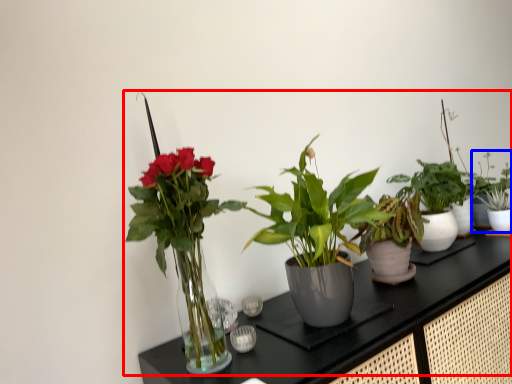
Question: Which object appears closest to the camera in this image, houseplant (highlighted by a red box) or houseplant (highlighted by a blue box)?

Choices:
 (A) houseplant
 (B) houseplant

Answer: (A)